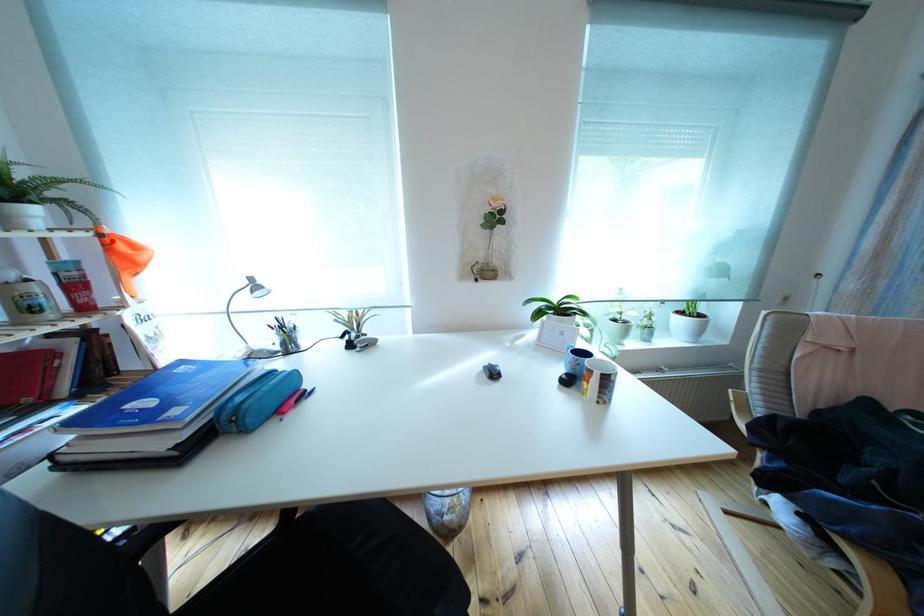
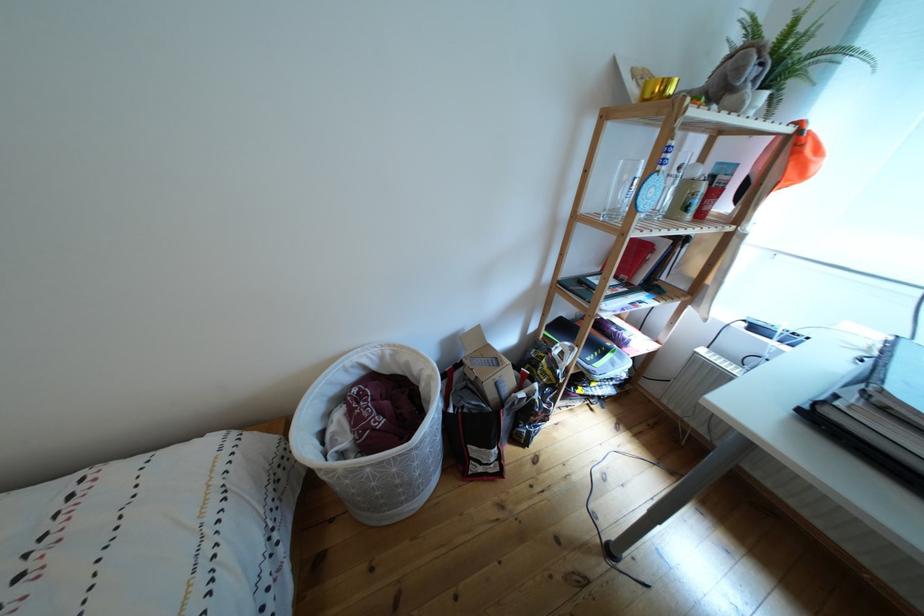
Find the pixel in the second image that matches the highlighted location in the first image.

(811, 138)